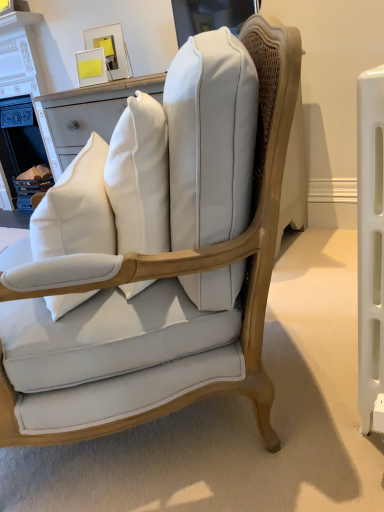
In order to face white cotton throw pillow at center, should I rotate leftwards or rightwards?

A 16.634 degree turn to the left will do.

Describe the element at coordinates (76, 209) in the screenshot. I see `white cotton throw pillow at center` at that location.

What do you see at coordinates (20, 56) in the screenshot? I see `white painted wood fireplace at upper left` at bounding box center [20, 56].

The width and height of the screenshot is (384, 512). I want to click on white cotton throw pillow at center, so click(x=76, y=209).

From the picture: Is white painted wood fireplace at upper left with white cotton throw pillow at center?

No, white painted wood fireplace at upper left is not making contact with white cotton throw pillow at center.

Is white cotton throw pillow at center a part of white painted wood fireplace at upper left?

Definitely not — white cotton throw pillow at center is not inside white painted wood fireplace at upper left.

Between white painted wood fireplace at upper left and white cotton throw pillow at center, which one appears on the left side from the viewer's perspective?

Positioned to the left is white painted wood fireplace at upper left.

From the image's perspective, is matte white cushioned chair at center located beneath white cotton throw pillow at center?

Yes, from the image's perspective, matte white cushioned chair at center is below white cotton throw pillow at center.

Which of these two, matte white cushioned chair at center or white cotton throw pillow at center, is wider?

matte white cushioned chair at center is wider.

From a real-world perspective, does matte white cushioned chair at center sit lower than white cotton throw pillow at center?

Correct, in the physical world, matte white cushioned chair at center is lower than white cotton throw pillow at center.

Is matte white cushioned chair at center positioned with its back to white cotton throw pillow at center?

Yes, white cotton throw pillow at center is at the back of matte white cushioned chair at center.

Is white cotton throw pillow at center positioned far away from matte white cushioned chair at center?

No, white cotton throw pillow at center is not far from matte white cushioned chair at center.

Who is bigger, white cotton throw pillow at center or matte white cushioned chair at center?

matte white cushioned chair at center.

Considering the relative sizes of white cotton throw pillow at center and matte white cushioned chair at center in the image provided, is white cotton throw pillow at center shorter than matte white cushioned chair at center?

Correct, white cotton throw pillow at center is not as tall as matte white cushioned chair at center.

Find the location of a particular element. This screenshot has height=512, width=384. chair below the white cotton throw pillow at center (from the image's perspective) is located at coordinates (209, 256).

Is white painted wood fireplace at upper left oriented towards matte white cushioned chair at center?

No, white painted wood fireplace at upper left is not aimed at matte white cushioned chair at center.

Is matte white cushioned chair at center inside white painted wood fireplace at upper left?

Definitely not — matte white cushioned chair at center is not inside white painted wood fireplace at upper left.

Would you consider white painted wood fireplace at upper left to be distant from matte white cushioned chair at center?

Yes, white painted wood fireplace at upper left and matte white cushioned chair at center are located far from each other.

Looking at this image, can you tell me how much white painted wood fireplace at upper left and matte white cushioned chair at center differ in facing direction?

The angular difference between white painted wood fireplace at upper left and matte white cushioned chair at center is 53.9 degrees.

Between white cotton throw pillow at center and white painted wood fireplace at upper left, which one has more height?

Standing taller between the two is white painted wood fireplace at upper left.

From a real-world perspective, is white cotton throw pillow at center located beneath white painted wood fireplace at upper left?

Yes.

Is point (36, 248) positioned in front of point (27, 35)?

Yes, it is in front of point (27, 35).

Is white cotton throw pillow at center bigger than white painted wood fireplace at upper left?

No.

Does point (263, 200) appear closer or farther from the camera than point (13, 39)?

Point (263, 200) is positioned closer to the camera compared to point (13, 39).

Is matte white cushioned chair at center behind white painted wood fireplace at upper left?

That is False.

Could you tell me if matte white cushioned chair at center is turned towards white painted wood fireplace at upper left?

No, matte white cushioned chair at center is not facing towards white painted wood fireplace at upper left.

Is matte white cushioned chair at center taller or shorter than white painted wood fireplace at upper left?

In the image, matte white cushioned chair at center appears to be shorter than white painted wood fireplace at upper left.

The image size is (384, 512). I want to click on fireplace positioned vertically above the white cotton throw pillow at center (from a real-world perspective), so click(20, 56).

Locate an element on the screen. Image resolution: width=384 pixels, height=512 pixels. throw pillow on the left of matte white cushioned chair at center is located at coordinates (76, 209).

Considering their positions, is matte white cushioned chair at center positioned further to white cotton throw pillow at center than white painted wood fireplace at upper left?

white painted wood fireplace at upper left.

Estimate the real-world distances between objects in this image. Which object is further from white painted wood fireplace at upper left, matte white cushioned chair at center or white cotton throw pillow at center?

The object further to white painted wood fireplace at upper left is matte white cushioned chair at center.

Looking at the image, which one is located closer to white painted wood fireplace at upper left, white cotton throw pillow at center or matte white cushioned chair at center?

white cotton throw pillow at center lies closer to white painted wood fireplace at upper left than the other object.

Estimate the real-world distances between objects in this image. Which object is closer to matte white cushioned chair at center, white painted wood fireplace at upper left or white cotton throw pillow at center?

white cotton throw pillow at center is closer to matte white cushioned chair at center.

Looking at the image, which one is located further to matte white cushioned chair at center, white cotton throw pillow at center or white painted wood fireplace at upper left?

Among the two, white painted wood fireplace at upper left is located further to matte white cushioned chair at center.

Which object lies further to the anchor point white cotton throw pillow at center, white painted wood fireplace at upper left or matte white cushioned chair at center?

white painted wood fireplace at upper left lies further to white cotton throw pillow at center than the other object.

At what (x,y) coordinates should I click in order to perform the action: click on throw pillow between matte white cushioned chair at center and white painted wood fireplace at upper left in the front-back direction. Please return your answer as a coordinate pair (x, y). This screenshot has height=512, width=384. Looking at the image, I should click on (76, 209).